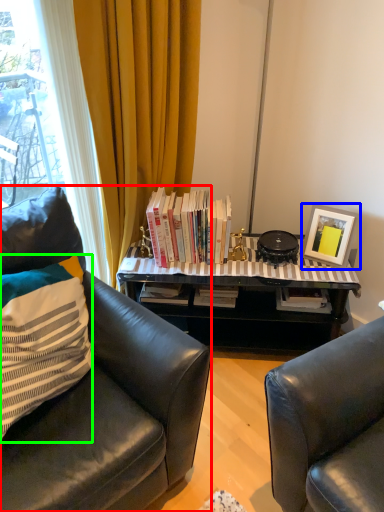
Question: Which is nearer to the chair (highlighted by a red box)? picture frame (highlighted by a blue box) or pillow (highlighted by a green box).

Choices:
 (A) picture frame
 (B) pillow

Answer: (B)